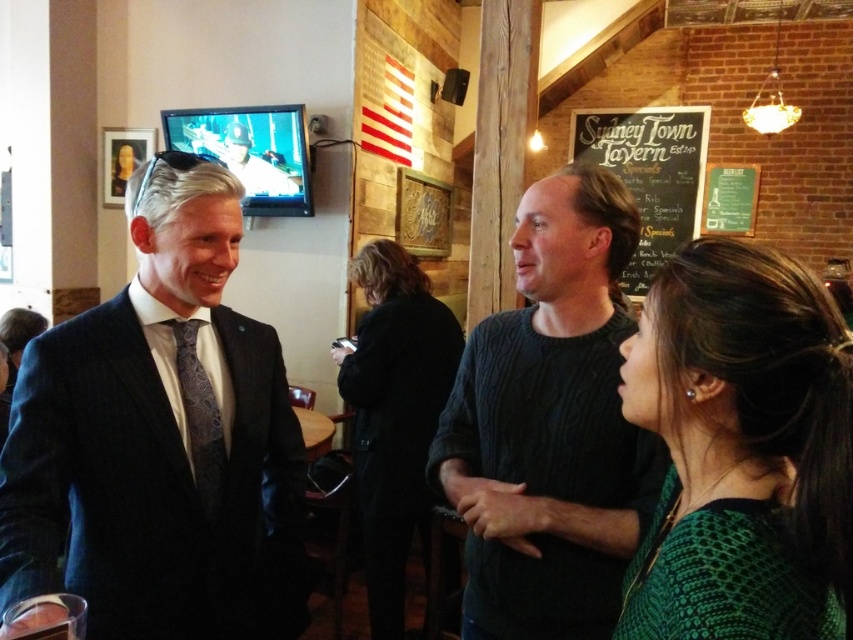
Question: Is dark knit sweater at center in front of dark brown leather jacket at center?

Choices:
 (A) no
 (B) yes

Answer: (B)

Question: Does black chalkboard at upper center have a greater width compared to dark blue textured tie at left?

Choices:
 (A) no
 (B) yes

Answer: (B)

Question: Which object is the closest to the matte black suit at left?

Choices:
 (A) dark blue textured tie at left
 (B) green textured sweater at lower right
 (C) dark brown leather jacket at center

Answer: (A)

Question: Which of these objects is positioned farthest from the matte black suit at left?

Choices:
 (A) dark knit sweater at center
 (B) dark brown leather jacket at center

Answer: (B)

Question: In this image, where is dark knit sweater at center located relative to dark blue textured tie at left?

Choices:
 (A) below
 (B) above

Answer: (B)

Question: Among these points, which one is farthest from the camera?

Choices:
 (A) (738, 486)
 (B) (624, 547)
 (C) (204, 419)

Answer: (C)